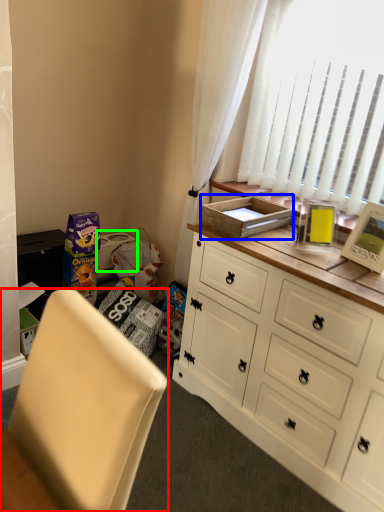
Question: Based on their relative distances, which object is farther from chair (highlighted by a red box)? Choose from cardboard box (highlighted by a blue box) and box (highlighted by a green box).

Choices:
 (A) cardboard box
 (B) box

Answer: (B)